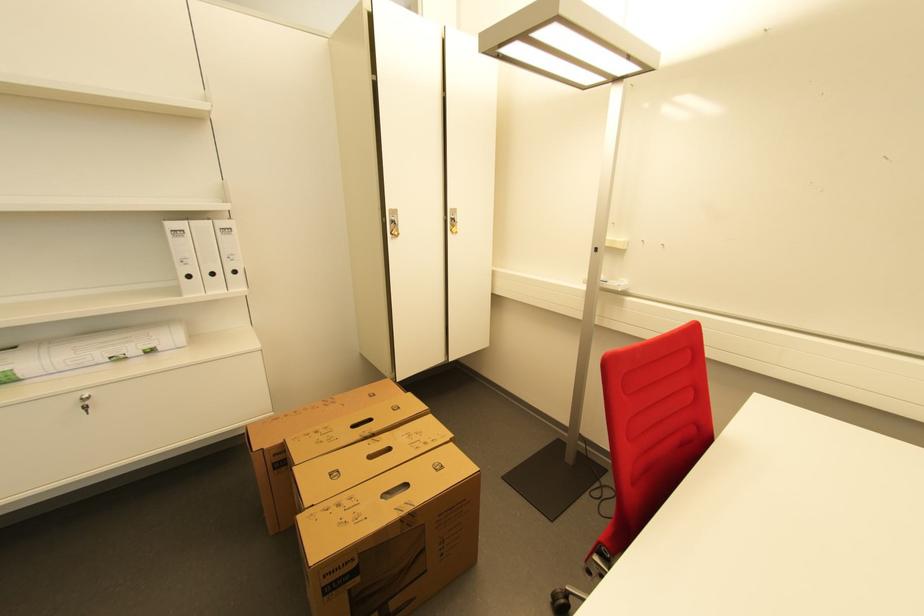
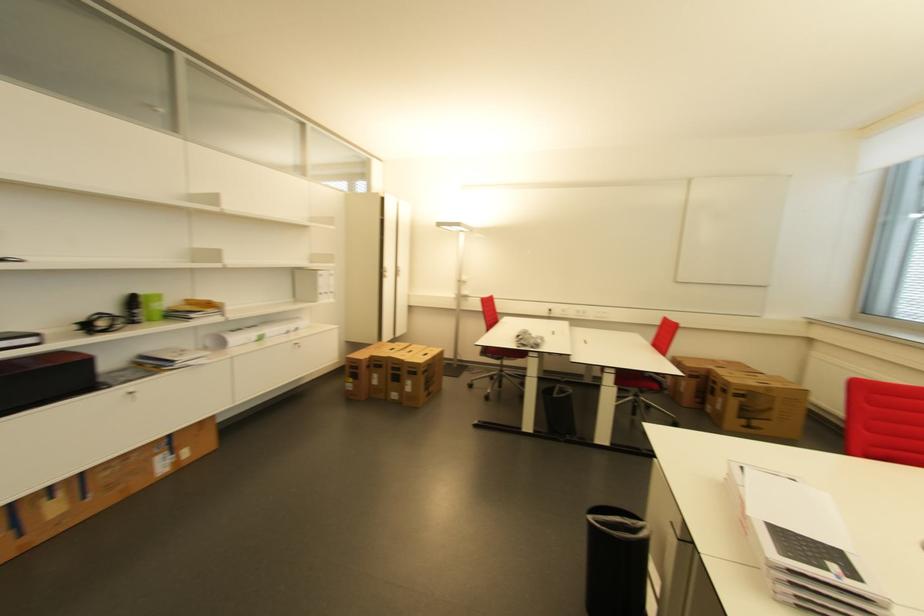
Question: I am providing you with two images of the same scene from different viewpoints. After the viewpoint changes to image2, which objects are now occluded?

Choices:
 (A) red chair sitting surface
 (B) cabinet keyhole handle
 (C) black trash can
 (D) none of these

Answer: (D)